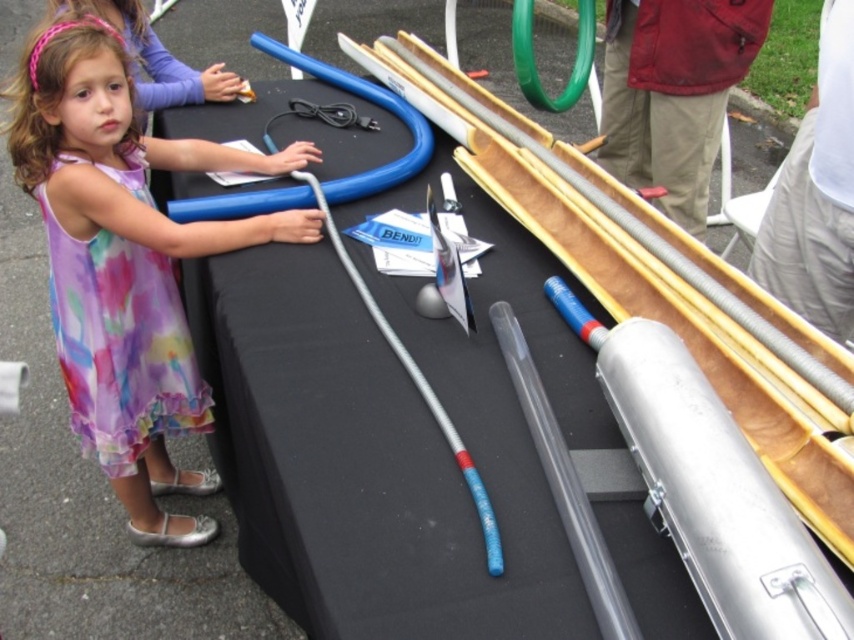
Question: Which of the following is the farthest from the observer?

Choices:
 (A) (75, 182)
 (B) (389, 392)

Answer: (A)

Question: Can you confirm if black fabric table at center is wider than matte purple dress at center?

Choices:
 (A) yes
 (B) no

Answer: (A)

Question: Does black fabric table at center have a larger size compared to matte purple dress at center?

Choices:
 (A) yes
 (B) no

Answer: (A)

Question: Which object appears closest to the camera in this image?

Choices:
 (A) black fabric table at center
 (B) matte purple dress at center

Answer: (A)

Question: Is black fabric table at center behind matte purple dress at center?

Choices:
 (A) yes
 (B) no

Answer: (B)

Question: Among these points, which one is farthest from the camera?

Choices:
 (A) (80, 358)
 (B) (427, 627)

Answer: (A)